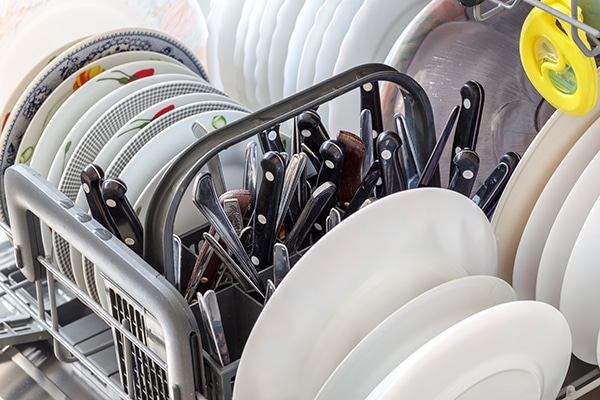
You are a GUI agent. You are given a task and a screenshot of the screen. Output one action in this format:
    pyautogui.click(x=<x>, y=<y>)
    Task: Click on the plates with patterns
    The image size is (600, 400).
    Given the screenshot: What is the action you would take?
    pyautogui.click(x=54, y=76), pyautogui.click(x=90, y=140), pyautogui.click(x=123, y=157), pyautogui.click(x=408, y=50)